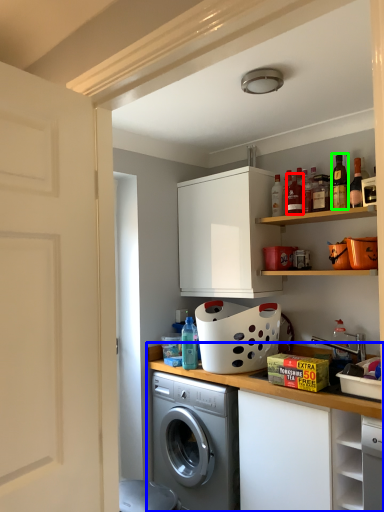
Question: Which object is positioned closest to bottle (highlighted by a red box)? Select from countertop (highlighted by a blue box) and bottle (highlighted by a green box).

Choices:
 (A) countertop
 (B) bottle

Answer: (B)